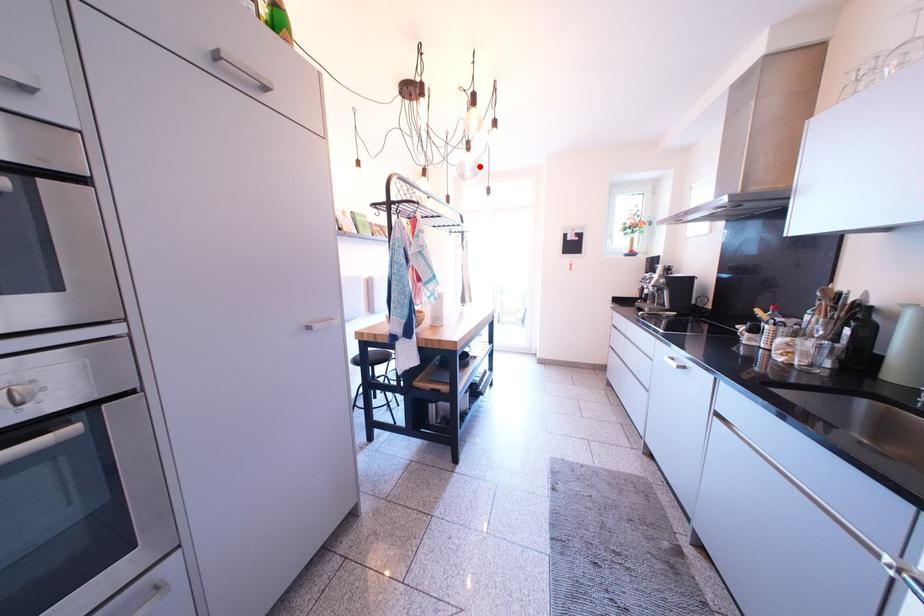
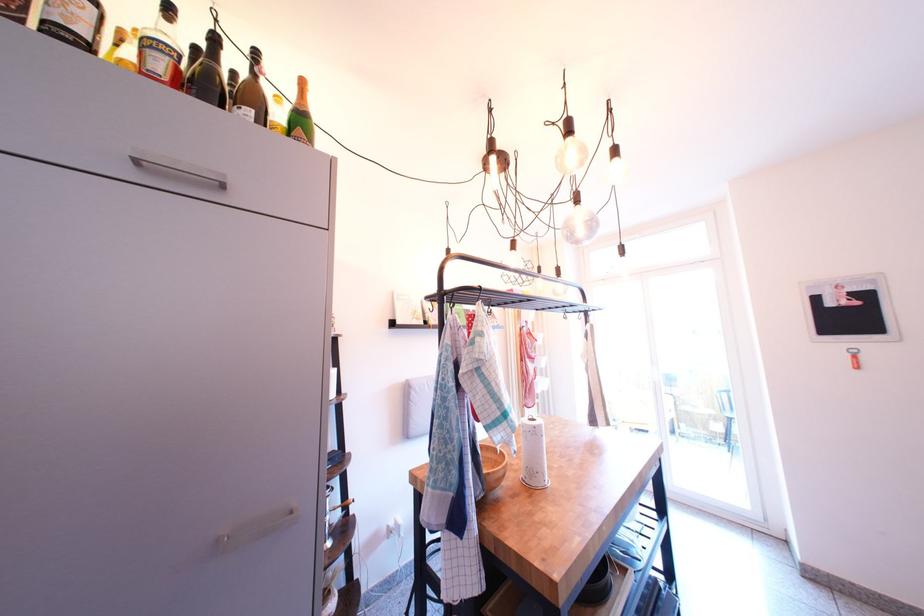
Where in the second image is the point corresponding to the highlighted location from the first image?

(590, 222)